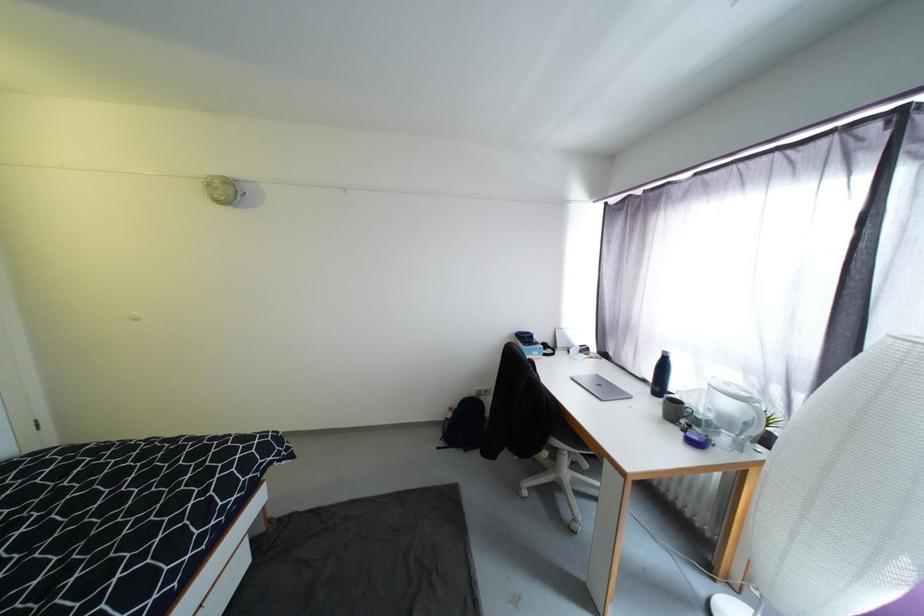
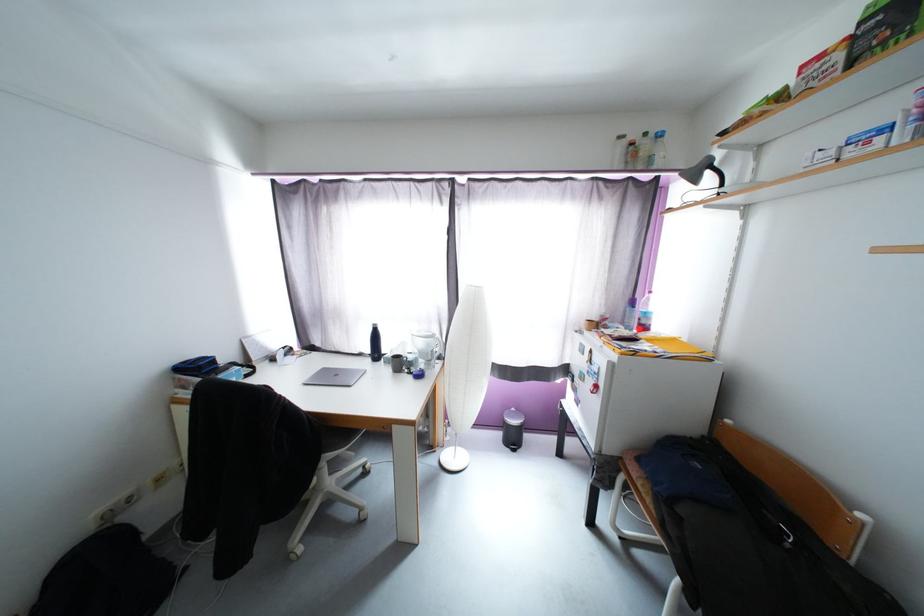
Where in the second image is the point corresponding to (733,386) from the first image?

(424, 333)